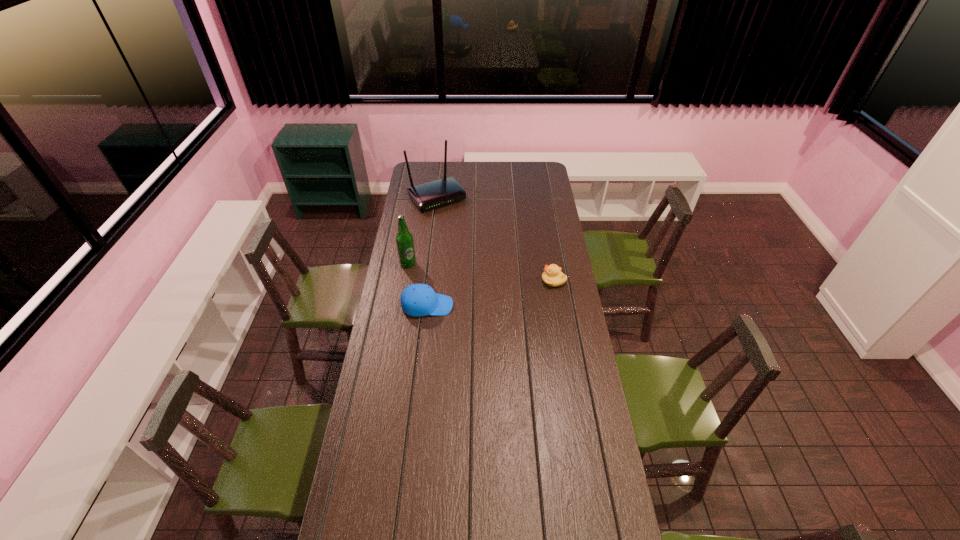
You are a GUI agent. You are given a task and a screenshot of the screen. Output one action in this format:
    pyautogui.click(x=<x>, y=<y>)
    Task: Click on the vacant space situated 0.320m on the label of the beer bottle
    This screenshot has height=540, width=960.
    Given the screenshot: What is the action you would take?
    pyautogui.click(x=474, y=280)

Image resolution: width=960 pixels, height=540 pixels. What are the coordinates of `free space located 0.130m on the label of the beer bottle` in the screenshot? It's located at (439, 272).

At what (x,y) coordinates should I click in order to perform the action: click on vacant space located on the front-facing side of the farthest object. Please return your answer as a coordinate pair (x, y). The image size is (960, 540). Looking at the image, I should click on (453, 217).

Locate an element on the screen. vacant area situated on the front-facing side of the farthest object is located at coordinates (463, 228).

In order to click on free region located on the front-facing side of the farthest object in this screenshot , I will do `click(459, 224)`.

The width and height of the screenshot is (960, 540). What are the coordinates of `cap at the left edge` in the screenshot? It's located at (418, 299).

You are a GUI agent. You are given a task and a screenshot of the screen. Output one action in this format:
    pyautogui.click(x=<x>, y=<y>)
    Task: Click on the beer bottle that is positioned at the left edge
    The width and height of the screenshot is (960, 540).
    Given the screenshot: What is the action you would take?
    pyautogui.click(x=404, y=240)

At what (x,y) coordinates should I click in order to perform the action: click on router that is at the left edge. Please return your answer as a coordinate pair (x, y). Looking at the image, I should click on (434, 194).

This screenshot has width=960, height=540. Find the location of `object present at the right edge`. object present at the right edge is located at coordinates (552, 276).

This screenshot has width=960, height=540. In the image, there is a desktop. Find the location of `free space at the far edge`. free space at the far edge is located at coordinates (461, 169).